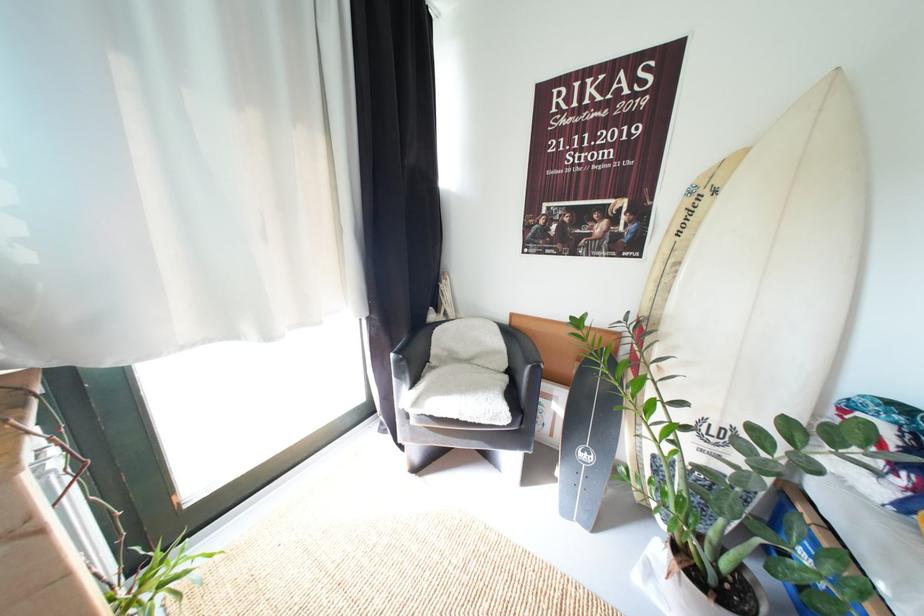
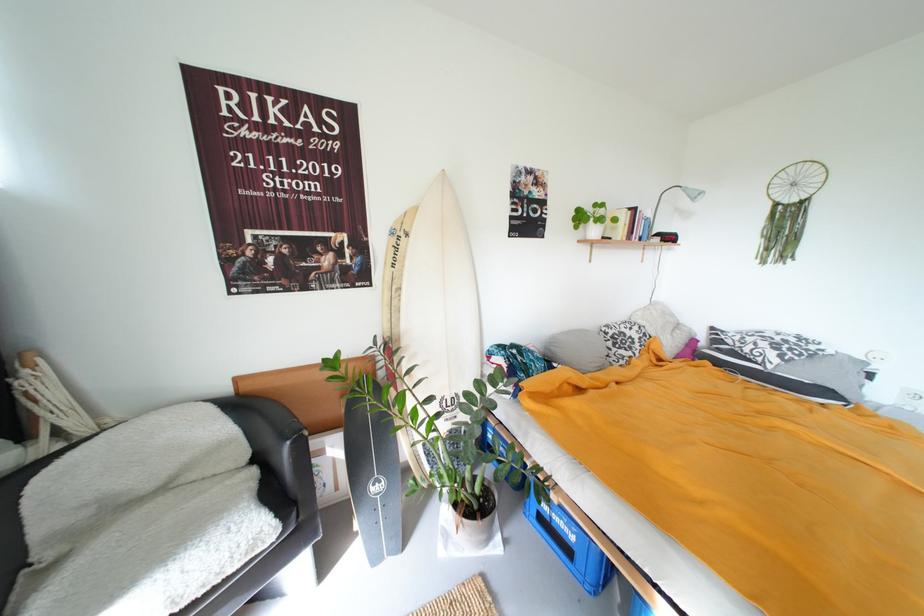
Find the pixel in the second image that matches (673,283) in the first image.

(402, 306)